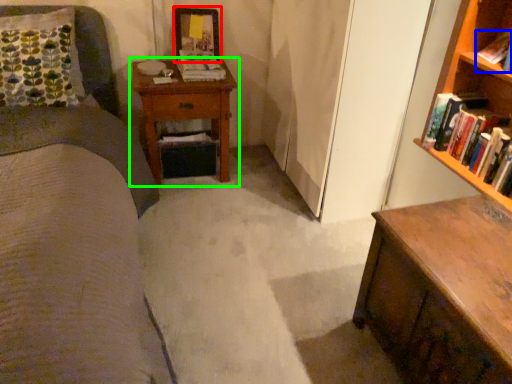
Question: Estimate the real-world distances between objects in this image. Which object is closer to picture frame (highlighted by a red box), book (highlighted by a blue box) or nightstand (highlighted by a green box)?

Choices:
 (A) book
 (B) nightstand

Answer: (B)